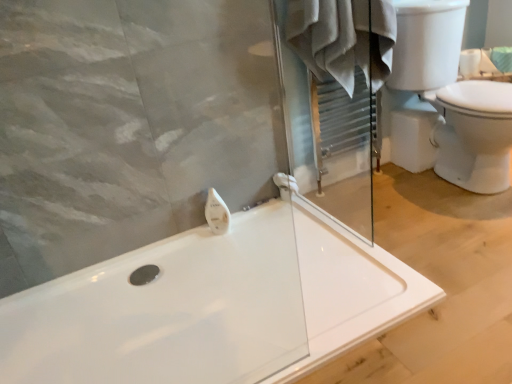
This screenshot has height=384, width=512. I want to click on vacant area that lies in front of white glossy toilet at right, so click(x=458, y=233).